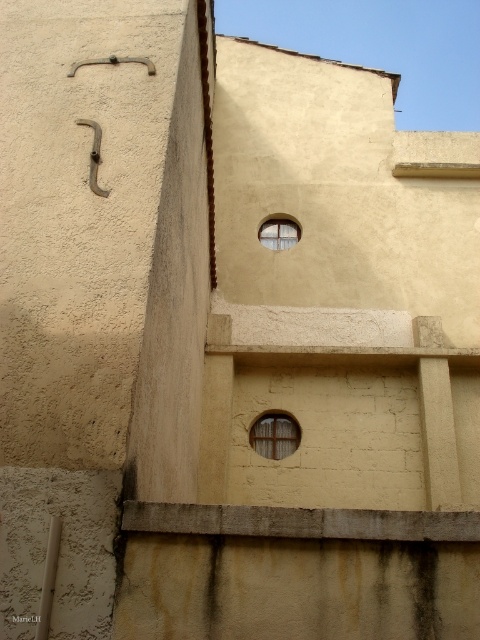
Question: Which point appears farthest from the camera in this image?

Choices:
 (A) (271, 240)
 (B) (276, 445)

Answer: (A)

Question: Which object appears farthest from the camera in this image?

Choices:
 (A) clear glass window at upper center
 (B) wooden at center

Answer: (A)

Question: Is wooden at center behind clear glass window at upper center?

Choices:
 (A) yes
 (B) no

Answer: (B)

Question: Which object appears closest to the camera in this image?

Choices:
 (A) wooden at center
 (B) clear glass window at upper center

Answer: (A)

Question: Is wooden at center wider than clear glass window at upper center?

Choices:
 (A) yes
 (B) no

Answer: (B)

Question: Observing the image, what is the correct spatial positioning of wooden at center in reference to clear glass window at upper center?

Choices:
 (A) left
 (B) right

Answer: (A)